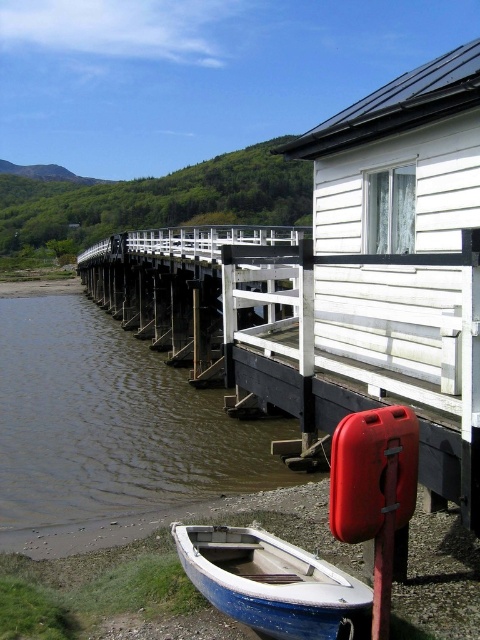
Does point (108, 321) come behind point (180, 556)?

Yes, point (108, 321) is farther from viewer.

Which is in front, point (13, 518) or point (203, 570)?

Positioned in front is point (203, 570).

Which is behind, point (85, 340) or point (192, 544)?

Point (85, 340)

Locate an element on the screen. This screenshot has height=640, width=480. brown murky water at lower left is located at coordinates (111, 422).

Between brown murky water at lower left and white wooden rail at center, which one has more height?

white wooden rail at center

Can you confirm if brown murky water at lower left is taller than white wooden rail at center?

No, brown murky water at lower left is not taller than white wooden rail at center.

Does point (12, 397) come closer to viewer compared to point (283, 250)?

No, it is not.

Identify the location of brown murky water at lower left. (111, 422).

Is white wooden rail at center bigger than blue painted wood boat at lower left?

Yes, white wooden rail at center is bigger than blue painted wood boat at lower left.

In the scene shown: Who is more forward, [274,278] or [330,595]?

Positioned in front is point [330,595].

At what (x,y) coordinates should I click in order to perform the action: click on white wooden rail at center. Please return your answer as a coordinate pair (x, y). The height and width of the screenshot is (640, 480). Looking at the image, I should click on (195, 288).